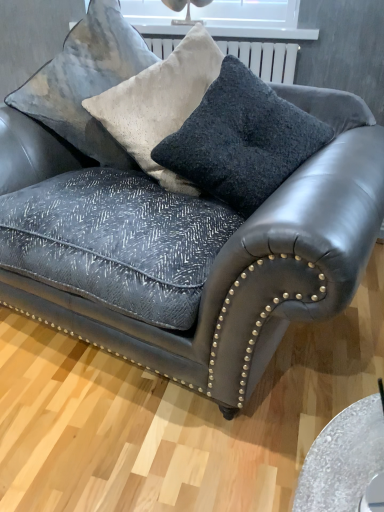
Question: Is velvet cushion at upper center shorter than velvet textured pillow at upper center, placed as the second throw pillow when sorted from right to left?

Choices:
 (A) yes
 (B) no

Answer: (B)

Question: Could you tell me if velvet cushion at upper center is turned towards velvet textured pillow at upper center, the first throw pillow from the left?

Choices:
 (A) yes
 (B) no

Answer: (B)

Question: From the image's perspective, is velvet cushion at upper center on top of velvet textured pillow at upper center, the first throw pillow from the left?

Choices:
 (A) no
 (B) yes

Answer: (B)

Question: Is velvet cushion at upper center in contact with velvet textured pillow at upper center, the first throw pillow from the left?

Choices:
 (A) no
 (B) yes

Answer: (A)

Question: Is velvet cushion at upper center wider than velvet textured pillow at upper center, the first throw pillow from the left?

Choices:
 (A) no
 (B) yes

Answer: (A)

Question: Is velvet textured pillow at upper center, the first throw pillow from the left, inside or outside of velvet cushion at upper center?

Choices:
 (A) inside
 (B) outside

Answer: (A)

Question: Is velvet textured pillow at upper center, placed as the second throw pillow when sorted from right to left, in front of or behind velvet cushion at upper center in the image?

Choices:
 (A) front
 (B) behind

Answer: (A)

Question: From the image's perspective, is velvet textured pillow at upper center, placed as the second throw pillow when sorted from right to left, above or below velvet cushion at upper center?

Choices:
 (A) above
 (B) below

Answer: (B)

Question: In terms of size, does velvet textured pillow at upper center, the first throw pillow from the left, appear bigger or smaller than velvet cushion at upper center?

Choices:
 (A) big
 (B) small

Answer: (B)

Question: In the image, is dark gray textured cushion at center, the first throw pillow in the right-to-left sequence, on the left side or the right side of velvet textured pillow at upper center, the first throw pillow from the left?

Choices:
 (A) left
 (B) right

Answer: (B)

Question: Looking at the image, does dark gray textured cushion at center, arranged as the 2th throw pillow when viewed from the left, seem bigger or smaller compared to velvet textured pillow at upper center, placed as the second throw pillow when sorted from right to left?

Choices:
 (A) small
 (B) big

Answer: (A)

Question: From the image's perspective, relative to velvet textured pillow at upper center, the first throw pillow from the left, is dark gray textured cushion at center, the first throw pillow in the right-to-left sequence, above or below?

Choices:
 (A) above
 (B) below

Answer: (B)

Question: Considering their positions, is dark gray textured cushion at center, arranged as the 2th throw pillow when viewed from the left, located in front of or behind velvet textured pillow at upper center, the first throw pillow from the left?

Choices:
 (A) front
 (B) behind

Answer: (A)

Question: Considering the positions of point (89, 110) and point (175, 169), is point (89, 110) closer or farther from the camera than point (175, 169)?

Choices:
 (A) closer
 (B) farther

Answer: (B)

Question: Considering the positions of velvet textured pillow at upper center, placed as the second throw pillow when sorted from right to left, and dark gray textured cushion at center, arranged as the 2th throw pillow when viewed from the left, in the image, is velvet textured pillow at upper center, placed as the second throw pillow when sorted from right to left, taller or shorter than dark gray textured cushion at center, arranged as the 2th throw pillow when viewed from the left,?

Choices:
 (A) tall
 (B) short

Answer: (A)